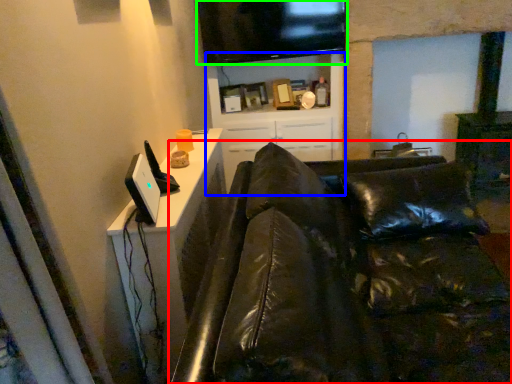
Question: Which object is the closest to the studio couch (highlighted by a red box)? Choose among these: entertainment center (highlighted by a blue box) or television (highlighted by a green box).

Choices:
 (A) entertainment center
 (B) television

Answer: (A)